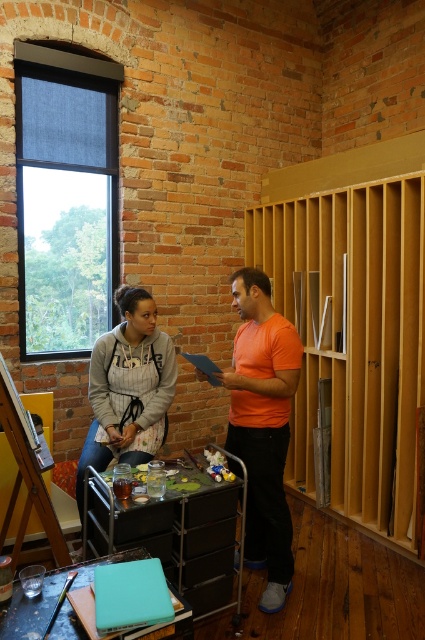
You are organizing a small event and need to place both the metallic silver cart at center and the matte gray hoodie at center in a storage room. Considering their sizes, which object should be placed first to maximize space efficiency?

The metallic silver cart at center is larger in size than the matte gray hoodie at center, so you should place the metallic silver cart at center first to ensure it fits properly before arranging the smaller matte gray hoodie at center.

You are an artist who just arrived at the studio and wants to hang your matte gray hoodie at center on the wooden easel at lower left. Can you do that based on their sizes?

The matte gray hoodie at center is larger in size than the wooden easel at lower left, so it may not fit properly on the easel.

You are an artist who needs to set up your workspace. You have a wooden at right and a wooden easel at lower left. Which object should you place first if you want to prioritize working with the larger item?

You should place the wooden at right first because it is larger in size than the wooden easel at lower left.